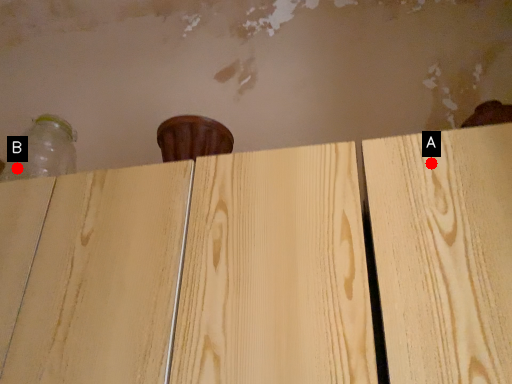
Question: Two points are circled on the image, labeled by A and B beside each circle. Which point appears closest to the camera in this image?

Choices:
 (A) A is closer
 (B) B is closer

Answer: (A)